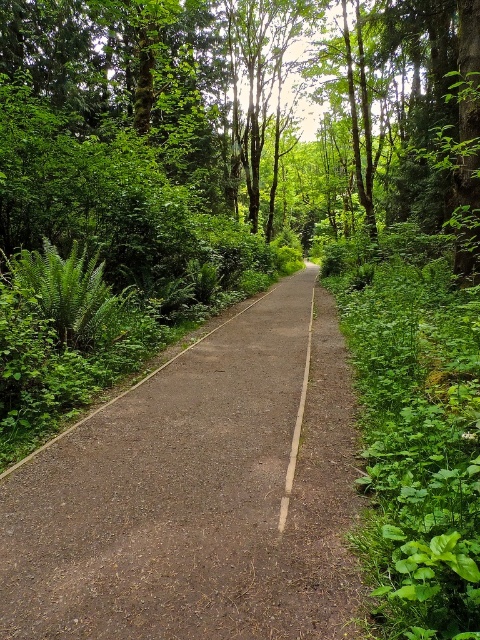
Question: Which object appears farthest from the camera in this image?

Choices:
 (A) dull brown asphalt at center
 (B) white painted line at center

Answer: (B)

Question: Is dull brown asphalt at center below white painted line at center?

Choices:
 (A) no
 (B) yes

Answer: (B)

Question: Among these objects, which one is farthest from the camera?

Choices:
 (A) dull brown asphalt at center
 (B) white painted line at center

Answer: (B)

Question: Can you confirm if dull brown asphalt at center is positioned below white painted line at center?

Choices:
 (A) yes
 (B) no

Answer: (A)

Question: Can you confirm if dull brown asphalt at center is smaller than white painted line at center?

Choices:
 (A) no
 (B) yes

Answer: (B)